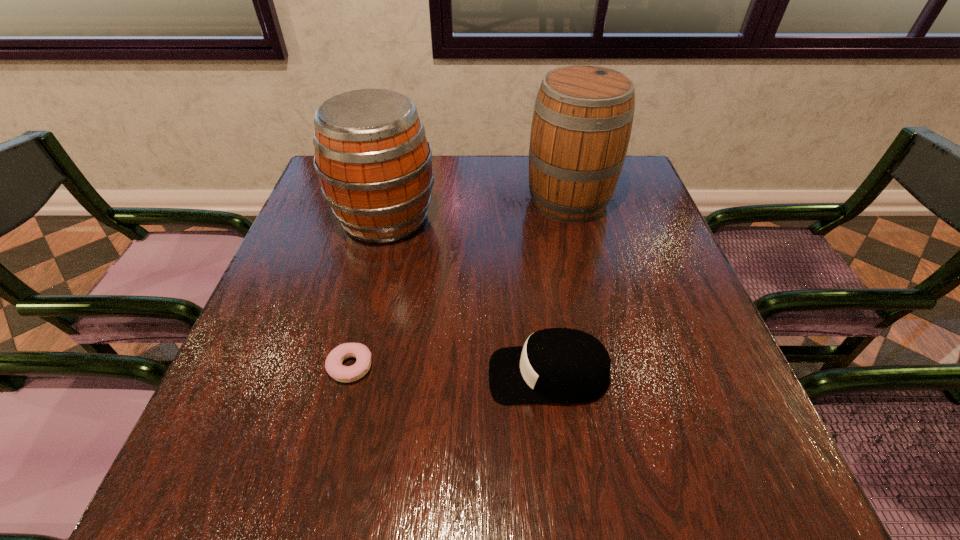
Choose which object is the nearest neighbor to the left cider. Please provide its 2D coordinates. Your answer should be formatted as a tuple, i.e. [(x, y)], where the tuple contains the x and y coordinates of a point satisfying the conditions above.

[(582, 121)]

Identify the location of object that stands as the second closest to the right cider. Image resolution: width=960 pixels, height=540 pixels. (556, 365).

In order to click on vacant area that satisfies the following two spatial constraints: 1. on the front side of the shortest object; 2. on the left side of the left cider in this screenshot , I will do `click(348, 367)`.